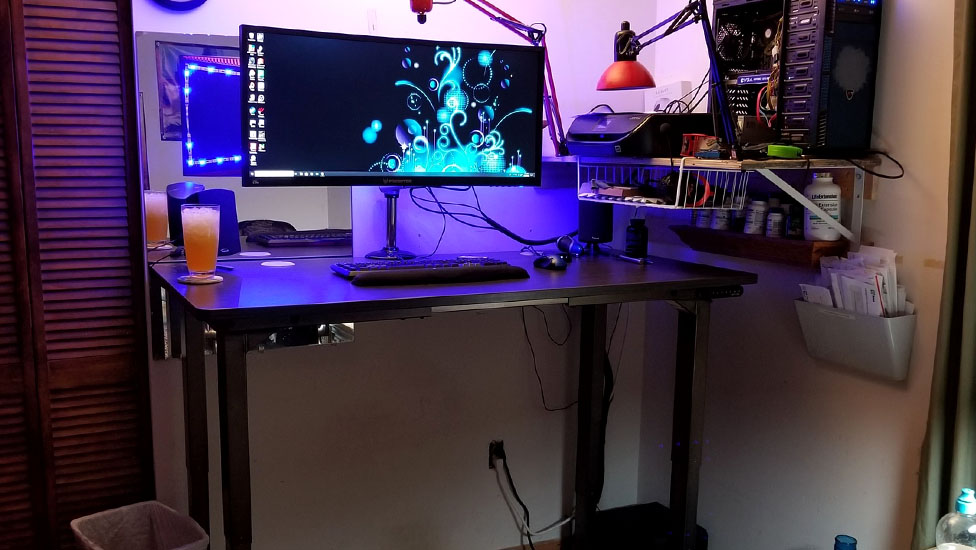
In order to click on lamp in this screenshot , I will do `click(626, 66)`.